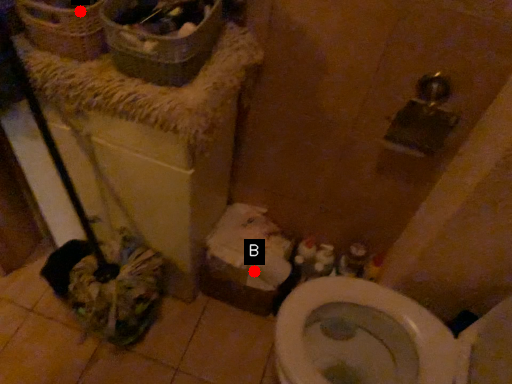
Question: Two points are circled on the image, labeled by A and B beside each circle. Which point is closer to the camera taking this photo?

Choices:
 (A) A is closer
 (B) B is closer

Answer: (A)